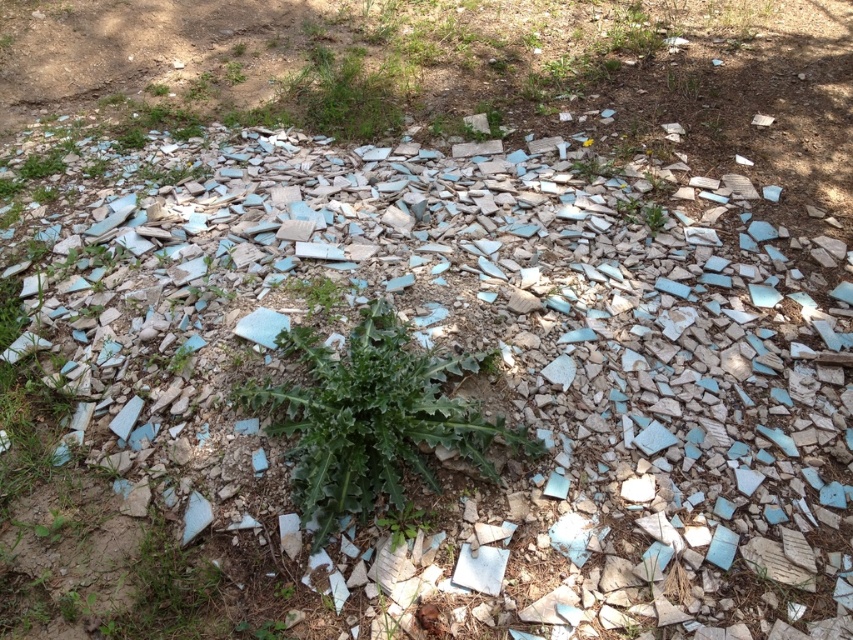
Question: Among these objects, which one is farthest from the camera?

Choices:
 (A) green leafy plant at upper center
 (B) green leafy plant at lower left
 (C) green leafy plant at center

Answer: (A)

Question: Does green leafy plant at center have a larger size compared to green leafy plant at lower left?

Choices:
 (A) yes
 (B) no

Answer: (A)

Question: Can you confirm if green leafy plant at center is positioned to the right of green leafy plant at upper center?

Choices:
 (A) no
 (B) yes

Answer: (A)

Question: Which point is closer to the camera?

Choices:
 (A) (602, 156)
 (B) (445, 403)
 (C) (164, 545)

Answer: (C)

Question: Which is nearer to the green leafy plant at center?

Choices:
 (A) green leafy plant at upper center
 (B) green leafy plant at lower left

Answer: (B)

Question: Is green leafy plant at center wider than green leafy plant at lower left?

Choices:
 (A) no
 (B) yes

Answer: (B)